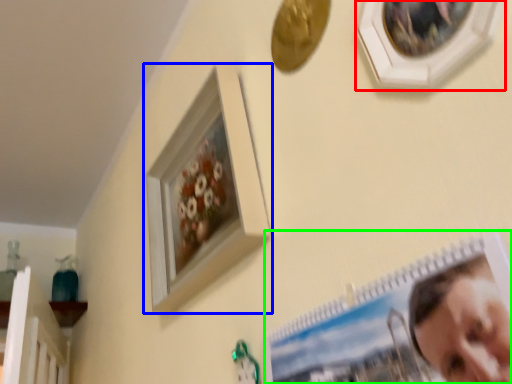
Question: Considering the real-world distances, which object is closest to picture frame (highlighted by a red box)? picture frame (highlighted by a blue box) or picture frame (highlighted by a green box).

Choices:
 (A) picture frame
 (B) picture frame

Answer: (B)